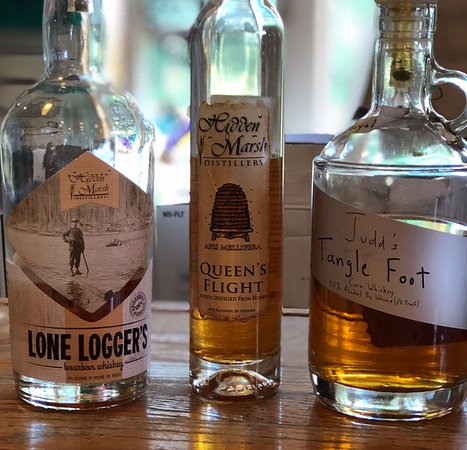
Identify the location of table. The height and width of the screenshot is (450, 467). (217, 425).